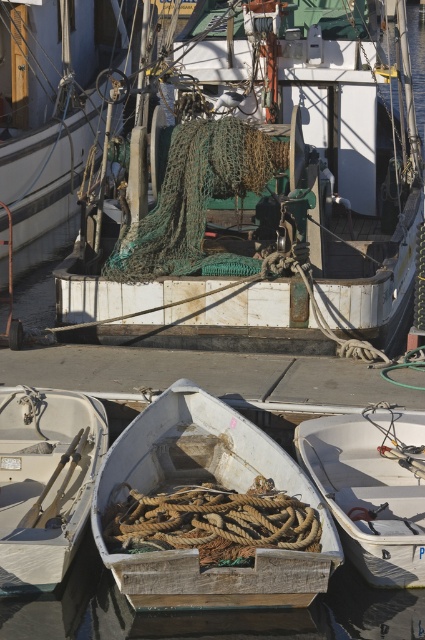
Question: Which is farther from the white matte boat at lower left?

Choices:
 (A) rusty metal boat at center
 (B) green netting at center
 (C) wooden rope-filled boat at center
 (D) white matte boat at lower center

Answer: (B)

Question: Which object is farther from the camera taking this photo?

Choices:
 (A) green netting at center
 (B) white matte boat at lower center
 (C) wooden rope-filled boat at center

Answer: (A)

Question: Is rusty metal boat at center to the right of wooden rope-filled boat at center from the viewer's perspective?

Choices:
 (A) no
 (B) yes

Answer: (A)

Question: Is white matte boat at lower left positioned behind white matte boat at lower center?

Choices:
 (A) no
 (B) yes

Answer: (B)

Question: Does wooden rope-filled boat at center come behind white matte boat at lower left?

Choices:
 (A) no
 (B) yes

Answer: (A)

Question: Estimate the real-world distances between objects in this image. Which object is closer to the white matte boat at lower center?

Choices:
 (A) wooden rope-filled boat at center
 (B) rusty metal boat at center
 (C) green netting at center

Answer: (A)